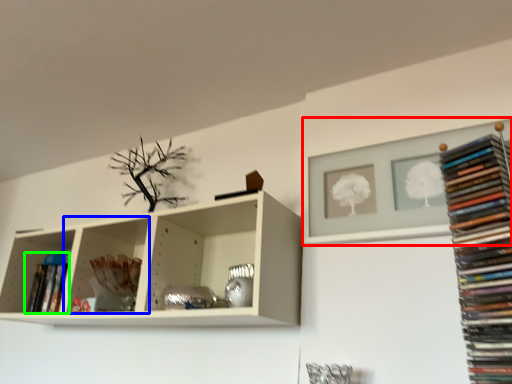
Question: Which object is the closest to the shelf (highlighted by a red box)? Choose among these: shelf (highlighted by a blue box) or book (highlighted by a green box).

Choices:
 (A) shelf
 (B) book

Answer: (A)